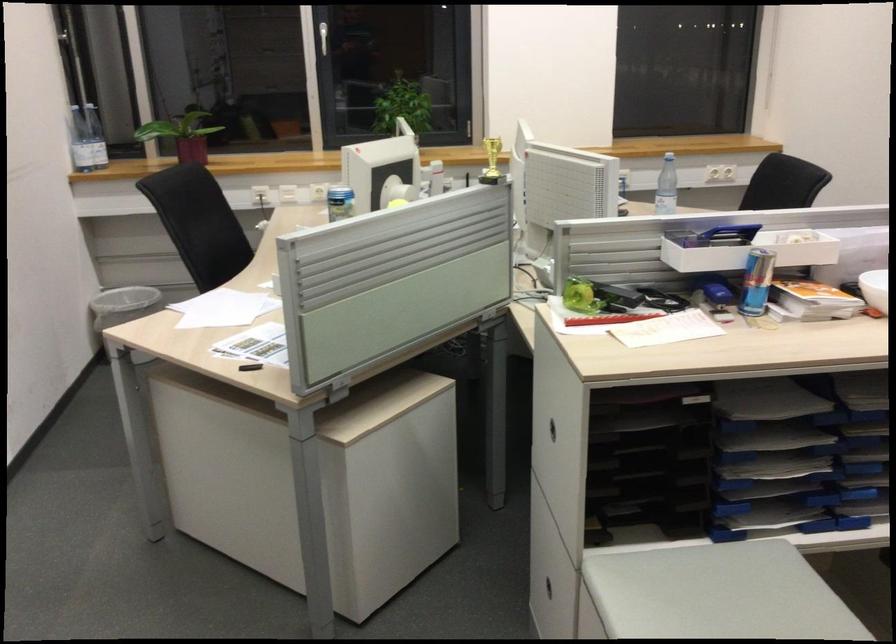
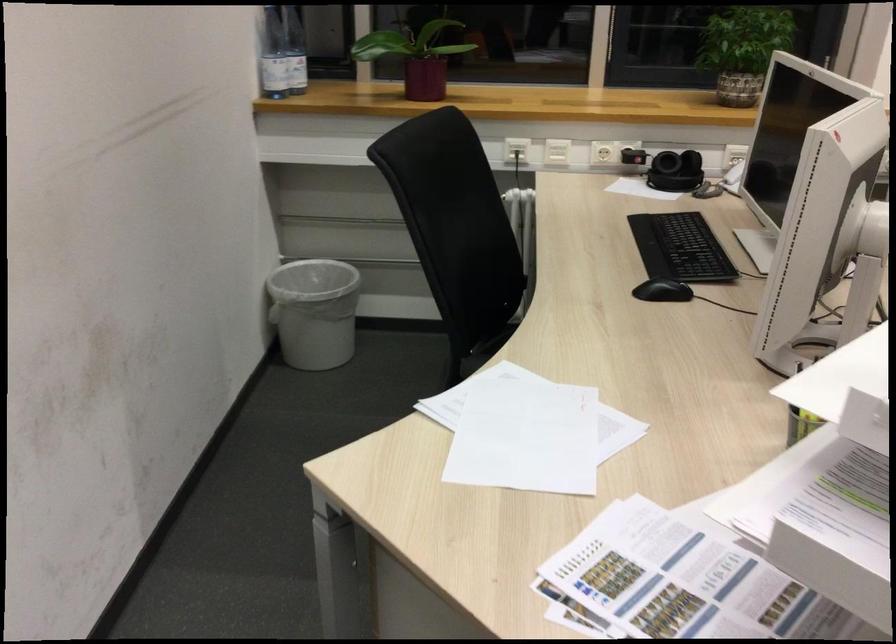
From the picture: In a continuous first-person perspective shot, in which direction is the camera moving?

The movement direction of the cameraman is left, forward.